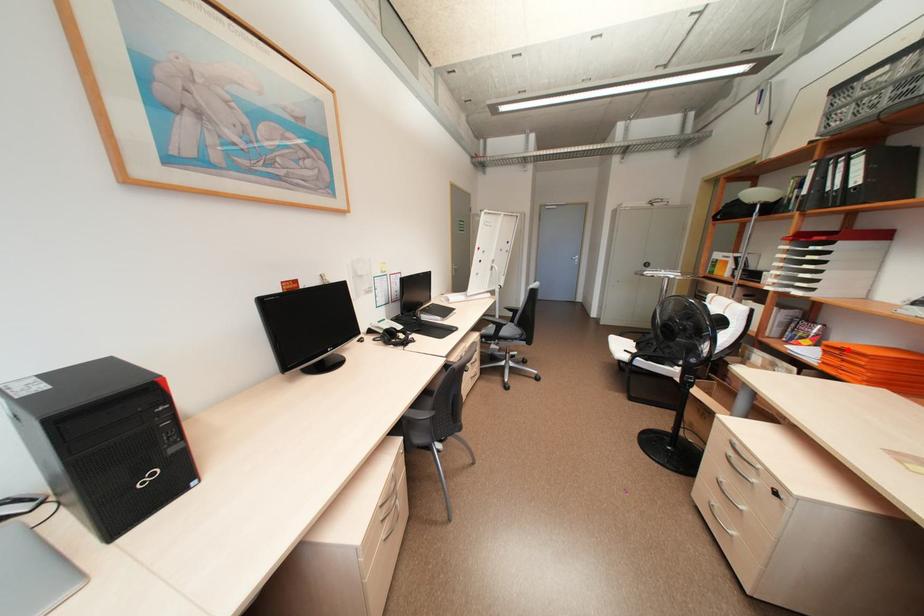
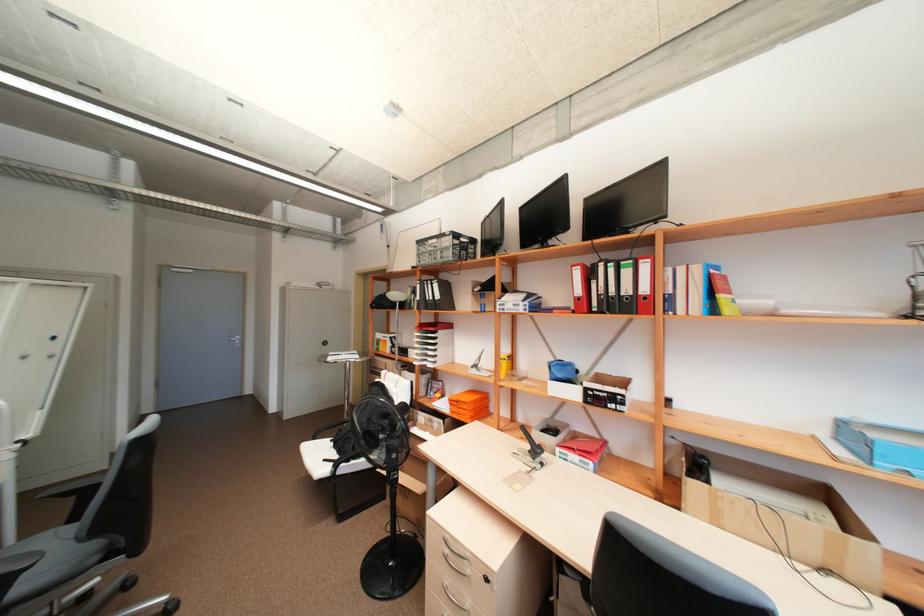
In the second image, find the point that corresponds to the highlighted location in the first image.

(463, 400)